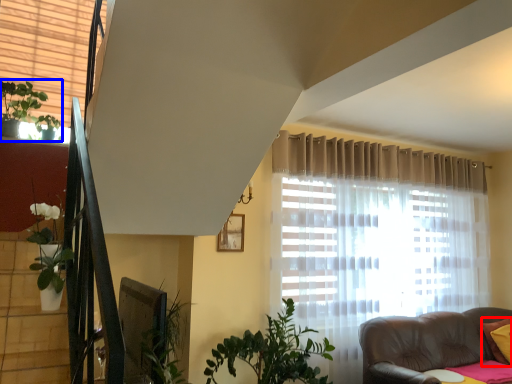
Question: Which point is further to the camera, pillow (highlighted by a red box) or houseplant (highlighted by a blue box)?

Choices:
 (A) pillow
 (B) houseplant

Answer: (A)